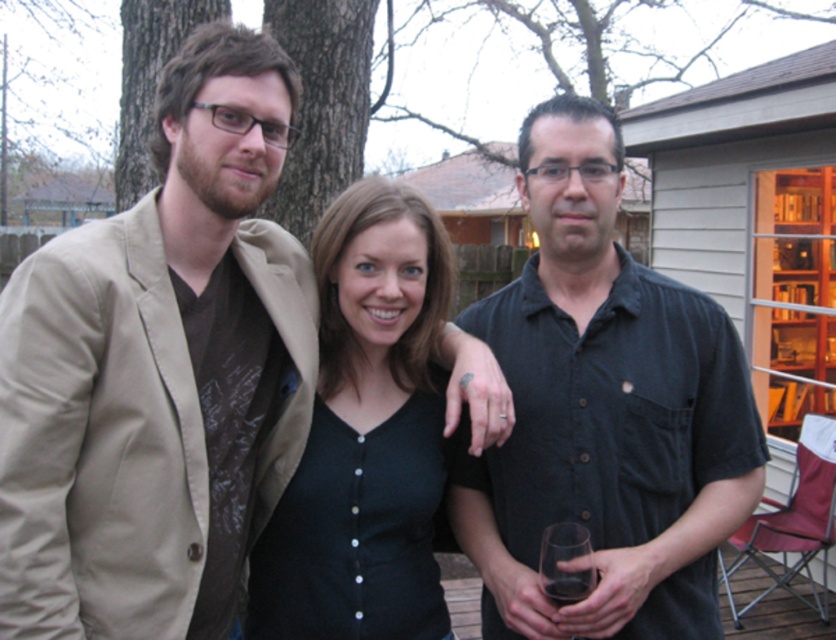
Which is more to the right, dark gray shirt at center or transparent glass at right?

From the viewer's perspective, dark gray shirt at center appears more on the right side.

Find the location of `dark gray shirt at center`. dark gray shirt at center is located at coordinates (604, 412).

Where is `dark gray shirt at center`? This screenshot has width=836, height=640. dark gray shirt at center is located at coordinates (604, 412).

Who is higher up, matte beige blazer at left or transparent glass at center?

matte beige blazer at left is higher up.

Is point (115, 230) closer to camera compared to point (549, 600)?

No.

Image resolution: width=836 pixels, height=640 pixels. Identify the location of matte beige blazer at left. (159, 371).

Does point (569, 561) lie in front of point (549, 588)?

That is True.

Looking at this image, who is positioned more to the right, transparent glass at right or transparent glass at center?

transparent glass at center

Who is more forward, (563, 522) or (575, 589)?

Point (575, 589) is more forward.

Image resolution: width=836 pixels, height=640 pixels. Find the location of `transparent glass at right`. transparent glass at right is located at coordinates (566, 564).